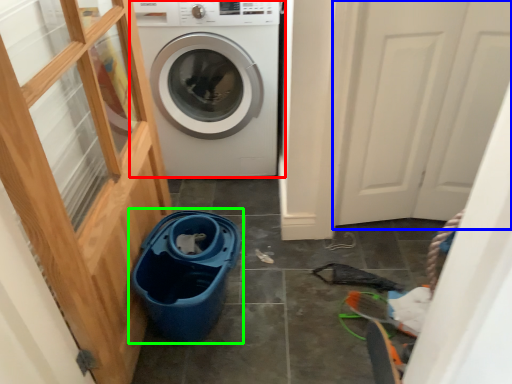
Question: Which object is the farthest from washing machine (highlighted by a red box)? Choose among these: screen door (highlighted by a blue box) or recycling bin (highlighted by a green box).

Choices:
 (A) screen door
 (B) recycling bin

Answer: (B)